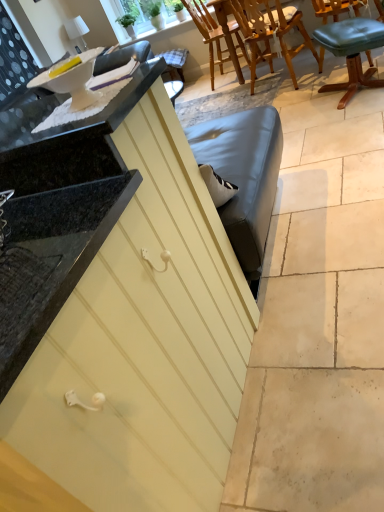
Question: Is wooden chair at upper center, arranged as the first chair when viewed from the back, further to the viewer compared to matte yellow cabinet at center?

Choices:
 (A) yes
 (B) no

Answer: (A)

Question: Does wooden chair at upper center, which is the third chair in front-to-back order, turn towards matte yellow cabinet at center?

Choices:
 (A) yes
 (B) no

Answer: (B)

Question: From the image's perspective, is wooden chair at upper center, which is the third chair in front-to-back order, on matte yellow cabinet at center?

Choices:
 (A) no
 (B) yes

Answer: (B)

Question: Is wooden chair at upper center, arranged as the first chair when viewed from the back, taller than matte yellow cabinet at center?

Choices:
 (A) yes
 (B) no

Answer: (B)

Question: Is wooden chair at upper center, which is the third chair in front-to-back order, at the right side of matte yellow cabinet at center?

Choices:
 (A) yes
 (B) no

Answer: (A)

Question: Choose the correct answer: Is wooden chair at upper center, which appears as the second chair when viewed from the front, inside green leather stool at upper right, the third chair from the back, or outside it?

Choices:
 (A) outside
 (B) inside

Answer: (A)

Question: In terms of size, does wooden chair at upper center, which appears as the second chair when viewed from the front, appear bigger or smaller than green leather stool at upper right, which is counted as the first chair, starting from the front?

Choices:
 (A) small
 (B) big

Answer: (B)

Question: Is point (253, 31) closer or farther from the camera than point (331, 88)?

Choices:
 (A) farther
 (B) closer

Answer: (A)

Question: Looking at their shapes, would you say wooden chair at upper center, which appears as the second chair when viewed from the front, is wider or thinner than green leather stool at upper right, the third chair from the back?

Choices:
 (A) thin
 (B) wide

Answer: (B)

Question: Is point (72, 307) closer or farther from the camera than point (134, 93)?

Choices:
 (A) farther
 (B) closer

Answer: (B)

Question: Considering the positions of matte yellow cabinet at center and white glossy countertop at upper left in the image, is matte yellow cabinet at center bigger or smaller than white glossy countertop at upper left?

Choices:
 (A) big
 (B) small

Answer: (A)

Question: Would you say matte yellow cabinet at center is to the left or to the right of white glossy countertop at upper left in the picture?

Choices:
 (A) right
 (B) left

Answer: (B)

Question: In the image, is matte yellow cabinet at center positioned in front of or behind white glossy countertop at upper left?

Choices:
 (A) behind
 (B) front

Answer: (B)

Question: Do you think green leather stool at upper right, which is counted as the first chair, starting from the front, is within matte yellow cabinet at center, or outside of it?

Choices:
 (A) inside
 (B) outside

Answer: (B)

Question: In the image, is green leather stool at upper right, the third chair from the back, positioned in front of or behind matte yellow cabinet at center?

Choices:
 (A) behind
 (B) front

Answer: (A)